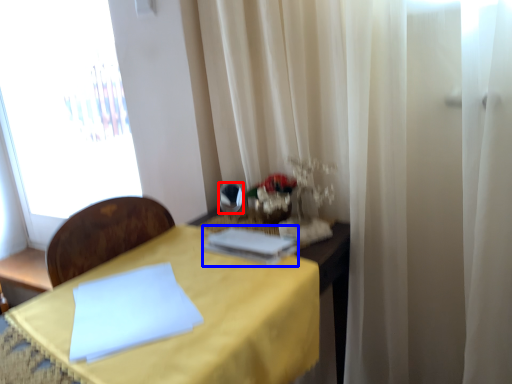
Question: Which object is closer to the camera taking this photo, mirror (highlighted by a red box) or book (highlighted by a blue box)?

Choices:
 (A) mirror
 (B) book

Answer: (B)